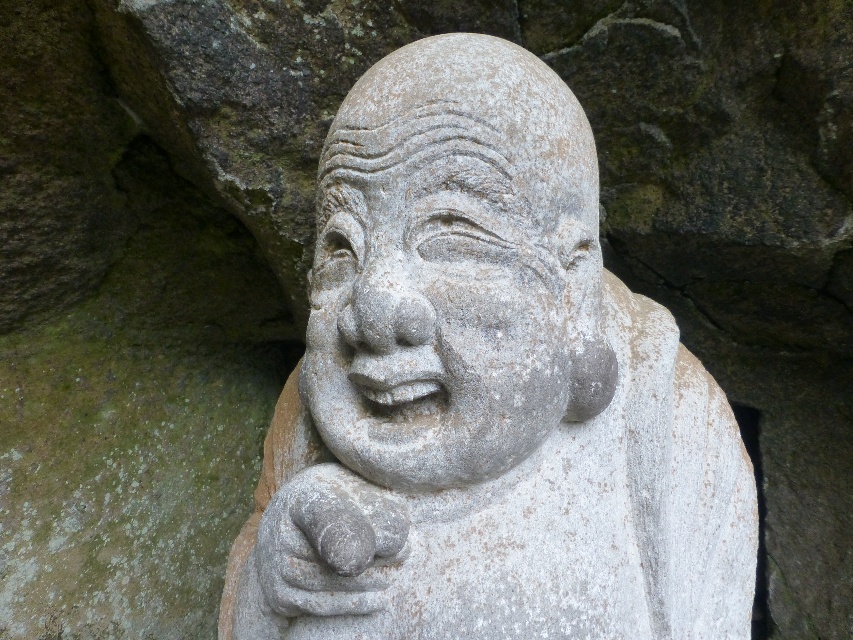
Is white stone statue at center below gray stone statue at center?

Yes, white stone statue at center is below gray stone statue at center.

Who is higher up, white stone statue at center or gray stone statue at center?

gray stone statue at center

Between point (514, 557) and point (587, 326), which one is positioned in front?

Point (514, 557)

This screenshot has height=640, width=853. What are the coordinates of `white stone statue at center` in the screenshot? It's located at (485, 392).